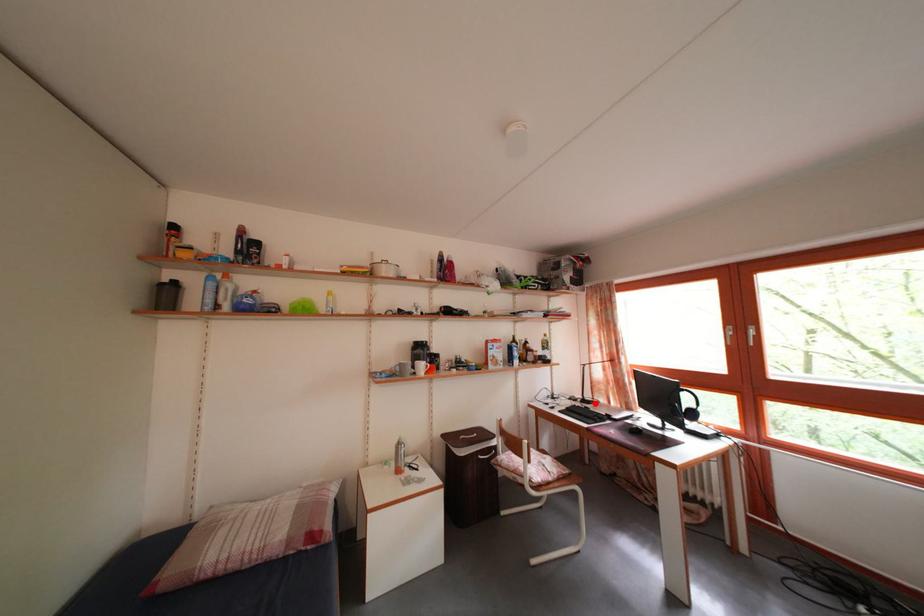
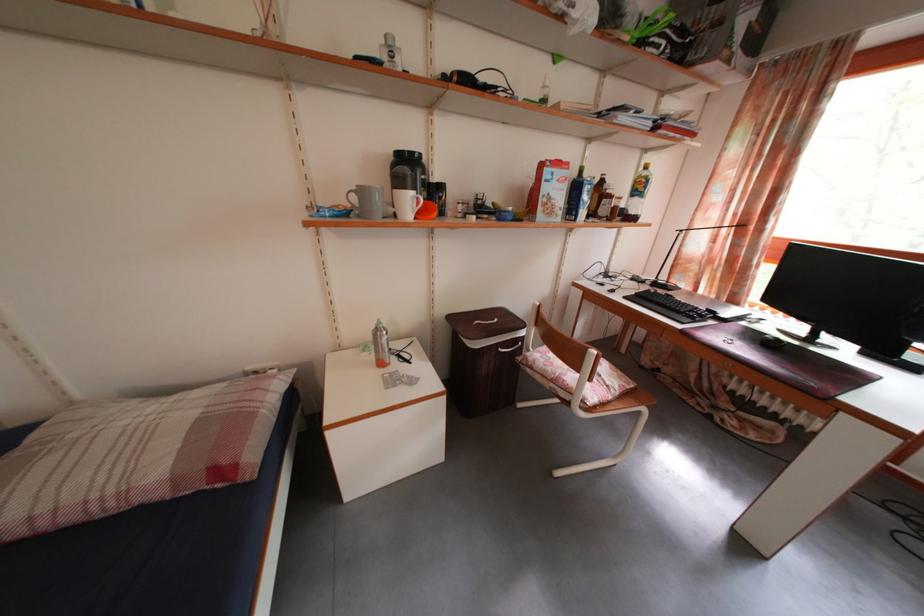
Question: A red point is marked in image1. In image2, is the corresponding 3D point closer to the camera or farther? Reply with the corresponding letter.

Choices:
 (A) The corresponding 3D point is closer.
 (B) The corresponding 3D point is farther.

Answer: (A)